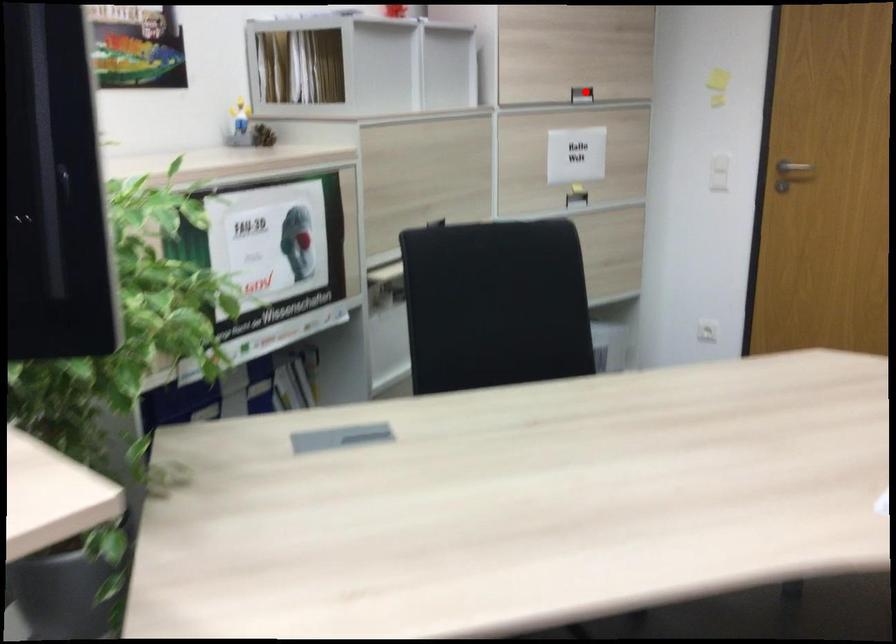
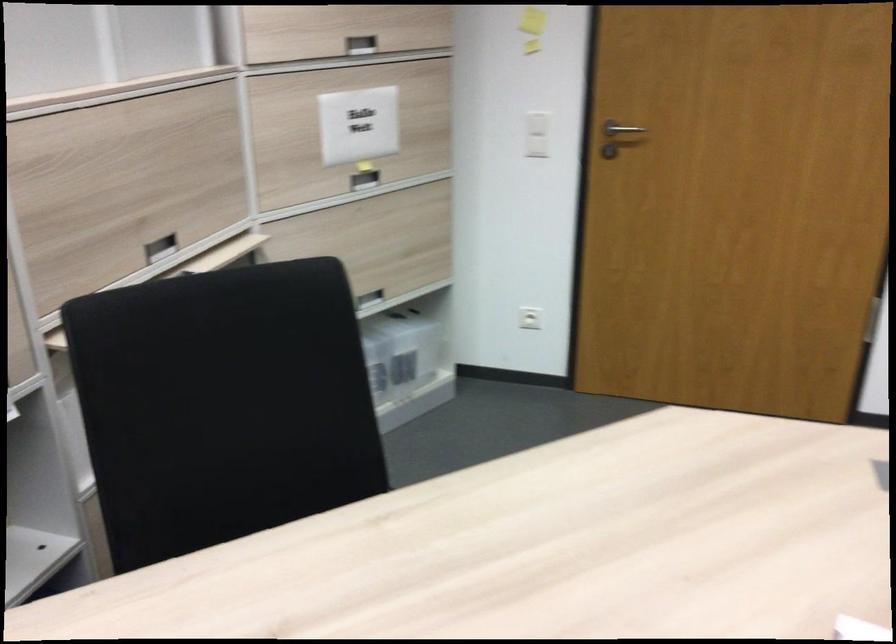
The point at the highlighted location is marked in the first image. Where is the corresponding point in the second image?

(360, 44)